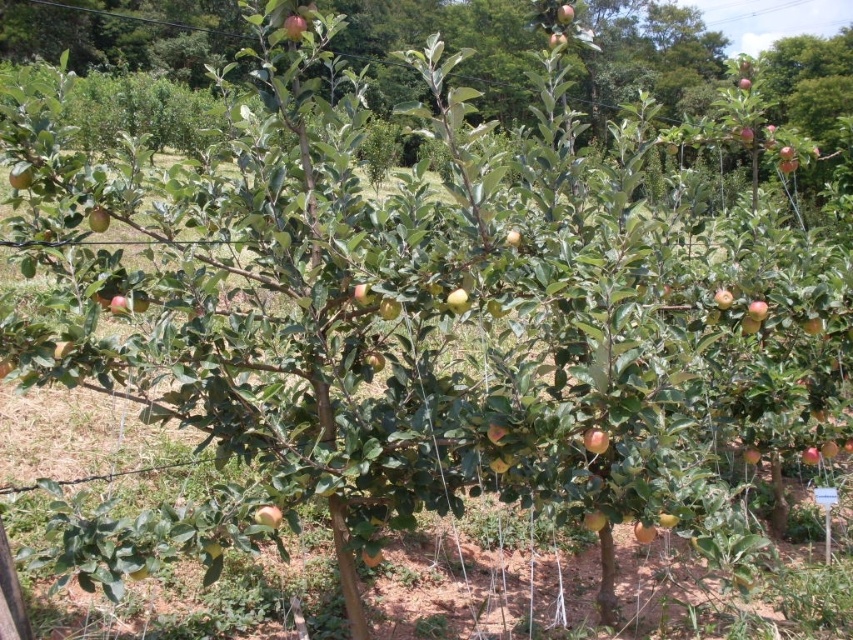
You are standing in the apple orchard and see the shiny red apple at center. If you want to pick it, which direction should you move relative to your current position?

The shiny red apple at center is located at coordinates point [268,515], so you should move towards the center of the orchard to reach it.

You are an apple picker standing in the orchard and see both the shiny red apple at center and the green matte apple at center. Which apple is positioned to the right side?

The shiny red apple at center is positioned to the right of the green matte apple at center.